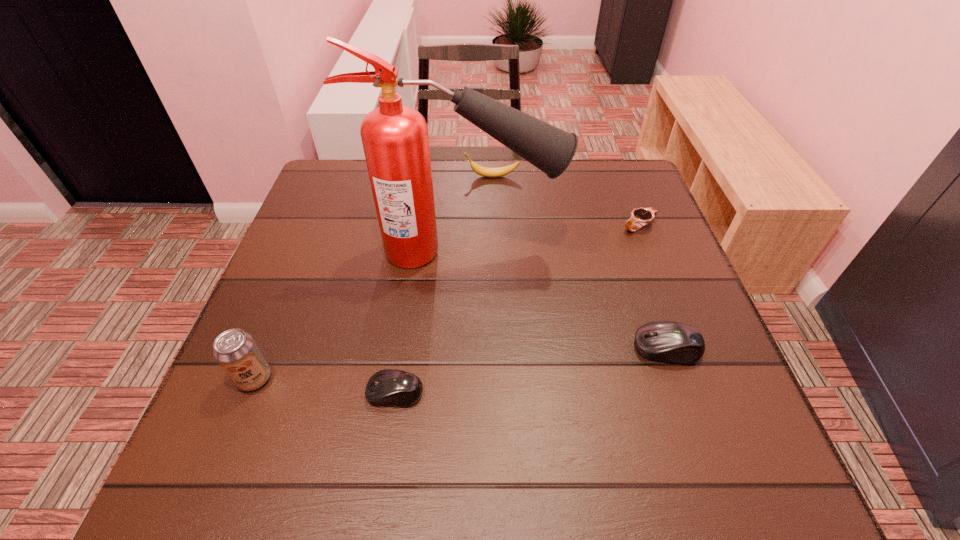
Locate an element on the screen. free space located 0.340m on the back of the left mouse is located at coordinates (416, 251).

The image size is (960, 540). I want to click on vacant space located 0.070m on the front of the farther mouse, so click(685, 401).

Find the location of `vacant space situated at the stem of the third tallest object`. vacant space situated at the stem of the third tallest object is located at coordinates (386, 177).

Image resolution: width=960 pixels, height=540 pixels. Find the location of `free spot located 0.160m at the stem of the third tallest object`. free spot located 0.160m at the stem of the third tallest object is located at coordinates (407, 177).

In order to click on free space located 0.170m at the stem of the third tallest object in this screenshot , I will do `click(404, 177)`.

This screenshot has width=960, height=540. Identify the location of vacant space located on the back of the shortest object. tap(618, 173).

Where is `free space located at the nozzle of the tallest object`? This screenshot has height=540, width=960. free space located at the nozzle of the tallest object is located at coordinates (610, 251).

The image size is (960, 540). I want to click on blank space located on the back of the leftmost object, so click(300, 266).

This screenshot has width=960, height=540. Identify the location of object that is at the far edge. (480, 170).

This screenshot has width=960, height=540. Find the location of `mouse located at the near edge`. mouse located at the near edge is located at coordinates (390, 387).